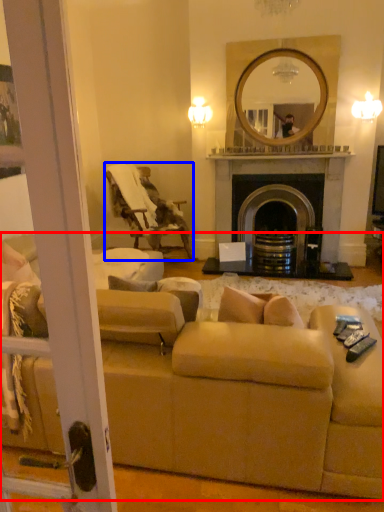
Question: Which object appears farthest to the camera in this image, studio couch (highlighted by a red box) or chair (highlighted by a blue box)?

Choices:
 (A) studio couch
 (B) chair

Answer: (B)